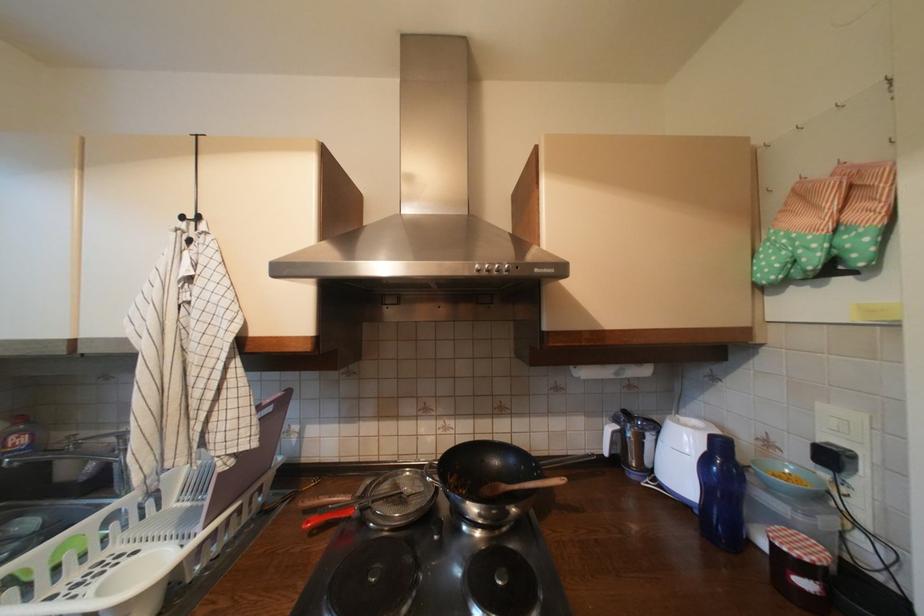
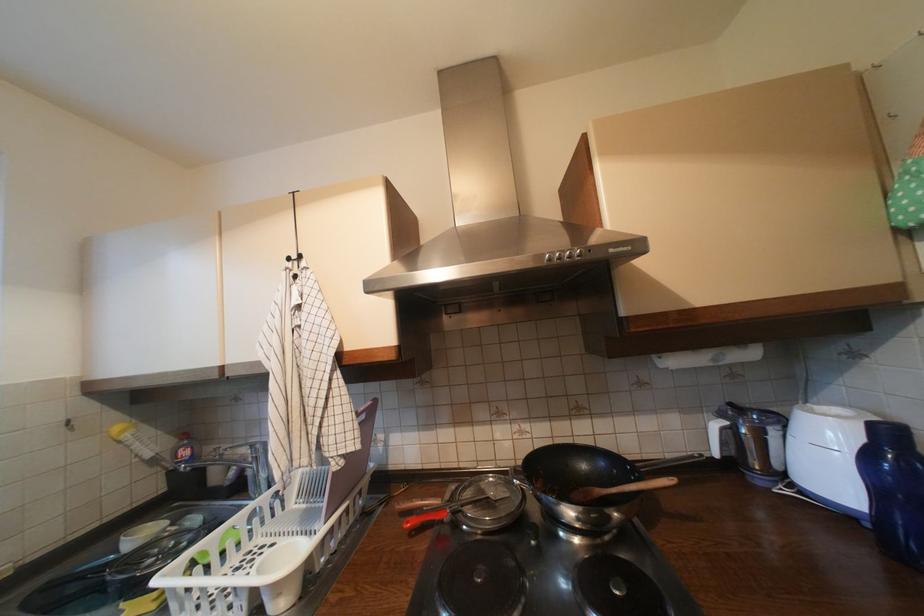
Where in the second image is the point corresponding to (67,437) from the first image?

(217, 450)